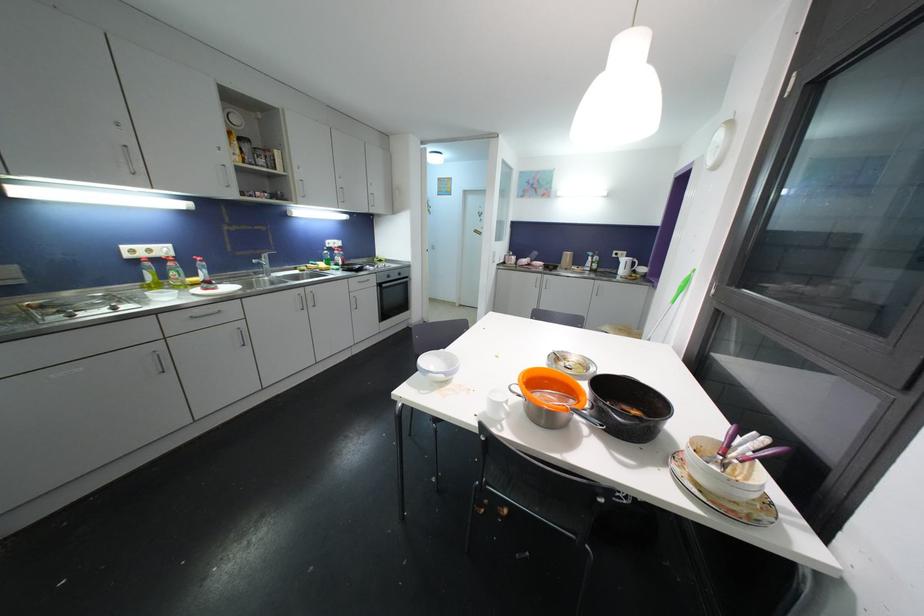
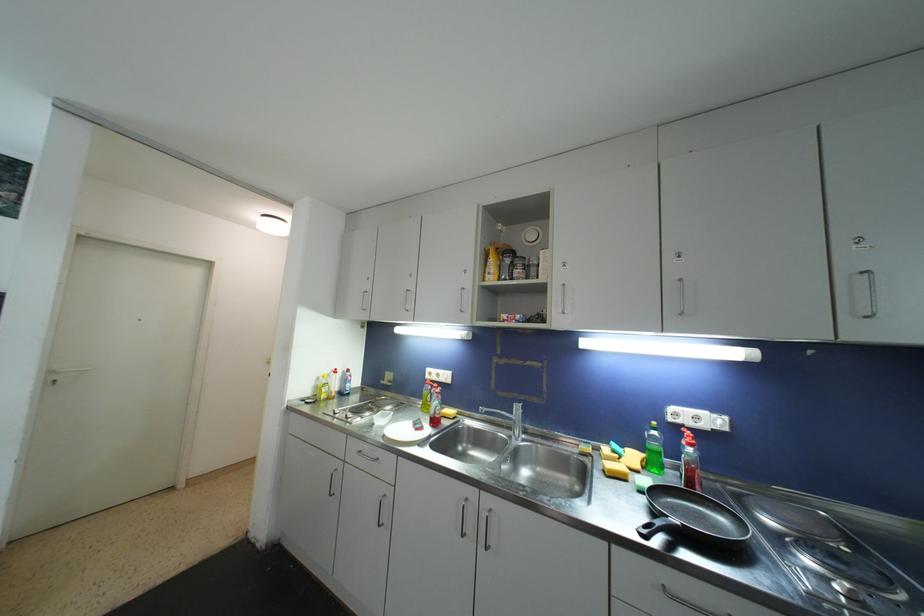
Where in the second image is the point corresponding to the point at 152,253 from the first image?

(441, 378)